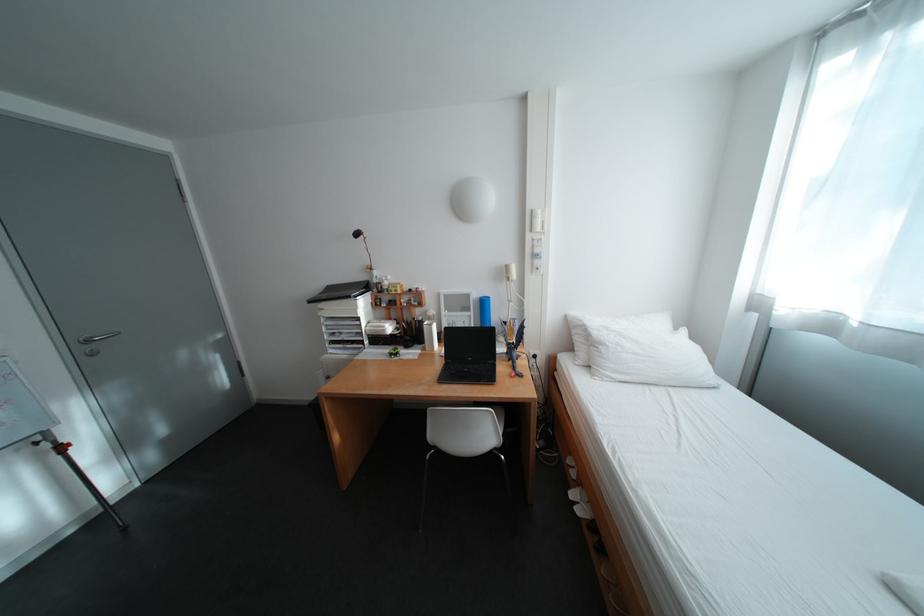
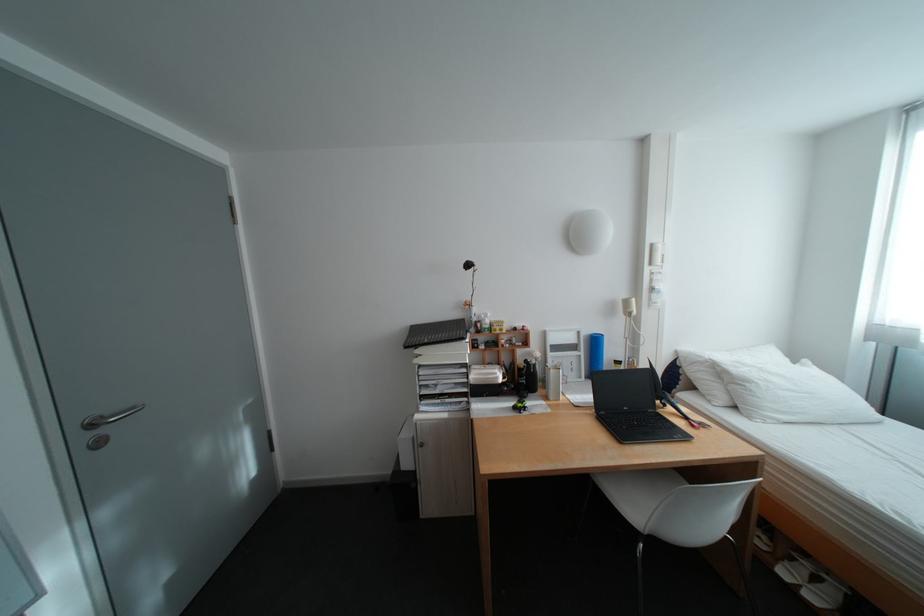
The point at (544,213) is marked in the first image. Where is the corresponding point in the second image?

(664, 246)